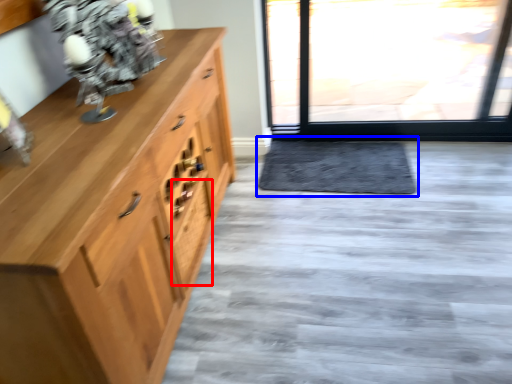
Question: Which object is further to the camera taking this photo, drawer (highlighted by a red box) or doormat (highlighted by a blue box)?

Choices:
 (A) drawer
 (B) doormat

Answer: (B)